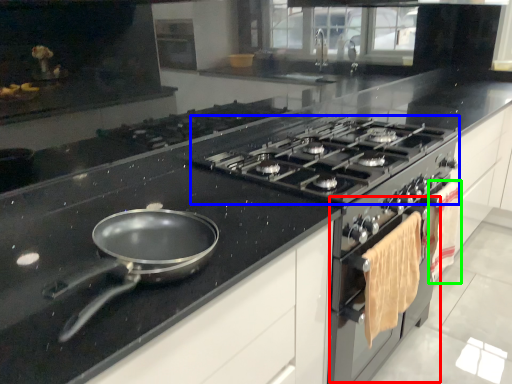
Question: Which object is positioned closest to oven (highlighted by a red box)? Select from gas stove (highlighted by a blue box) and material (highlighted by a green box).

Choices:
 (A) gas stove
 (B) material

Answer: (B)